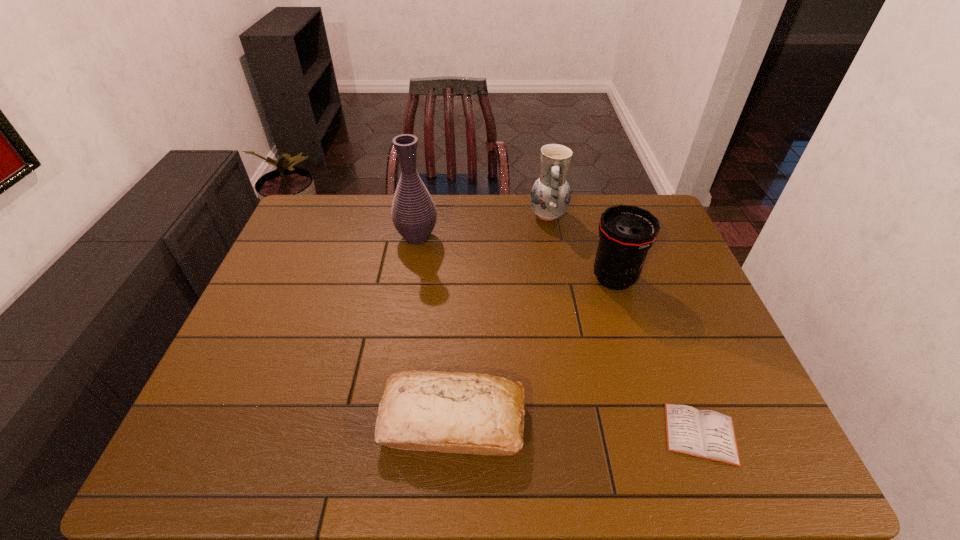
I want to click on empty location between the tallest object and the second shortest object, so click(435, 329).

You are a GUI agent. You are given a task and a screenshot of the screen. Output one action in this format:
    pyautogui.click(x=<x>, y=<y>)
    Task: Click on the free space between the third object from right to left and the telephoto lens
    
    Given the screenshot: What is the action you would take?
    pyautogui.click(x=581, y=247)

Identify the location of vacant space that's between the shortest object and the telephoto lens. (658, 356).

Locate an element on the screen. Image resolution: width=960 pixels, height=540 pixels. empty location between the pottery and the telephoto lens is located at coordinates (581, 247).

Image resolution: width=960 pixels, height=540 pixels. What are the coordinates of `free space that is in between the tallest object and the diary` in the screenshot? It's located at (559, 335).

Where is `free spot between the telephoto lens and the shortest object`? This screenshot has width=960, height=540. free spot between the telephoto lens and the shortest object is located at coordinates (658, 356).

Where is `object that is the second nearest to the tallest object`? This screenshot has height=540, width=960. object that is the second nearest to the tallest object is located at coordinates (626, 232).

Locate which object is the closest to the bread. Please provide its 2D coordinates. Your answer should be formatted as a tuple, i.e. [(x, y)], where the tuple contains the x and y coordinates of a point satisfying the conditions above.

[(706, 434)]

I want to click on free point that satisfies the following two spatial constraints: 1. on the back side of the telephoto lens; 2. on either side of the second tallest object, so click(594, 215).

Where is `free space that satisfies the following two spatial constraints: 1. on the front side of the vase; 2. on the left side of the third nearest object`? This screenshot has height=540, width=960. free space that satisfies the following two spatial constraints: 1. on the front side of the vase; 2. on the left side of the third nearest object is located at coordinates (410, 278).